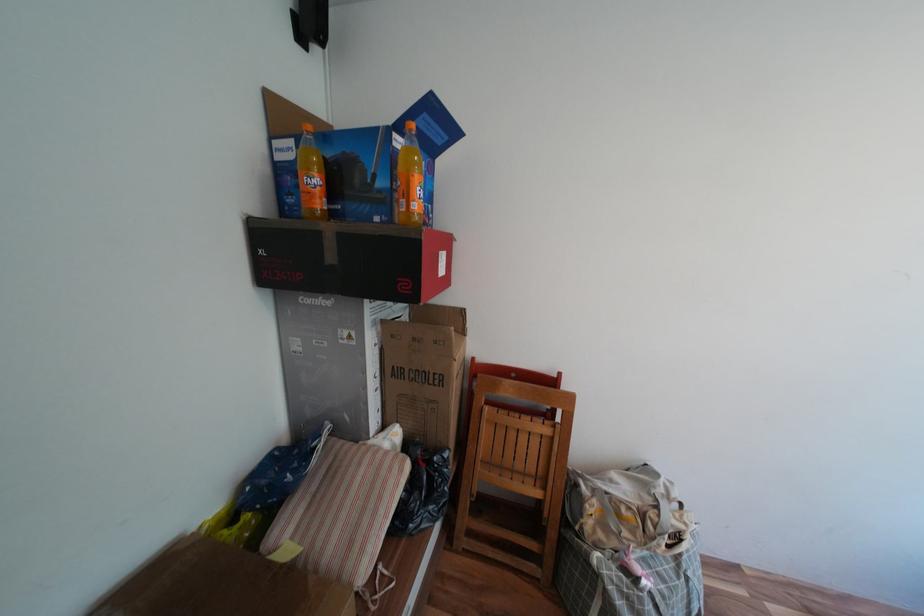
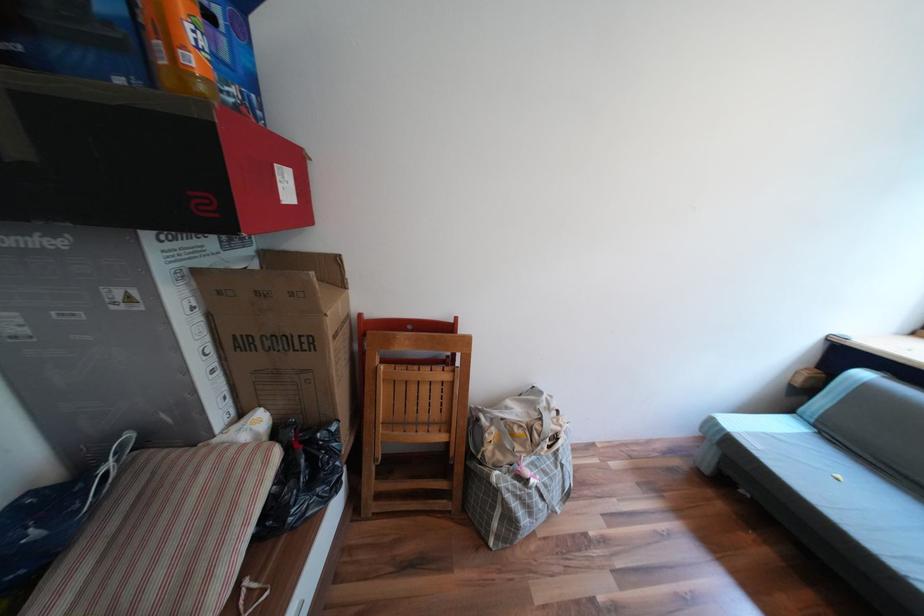
The point at (399, 469) is marked in the first image. Where is the corresponding point in the second image?

(258, 464)